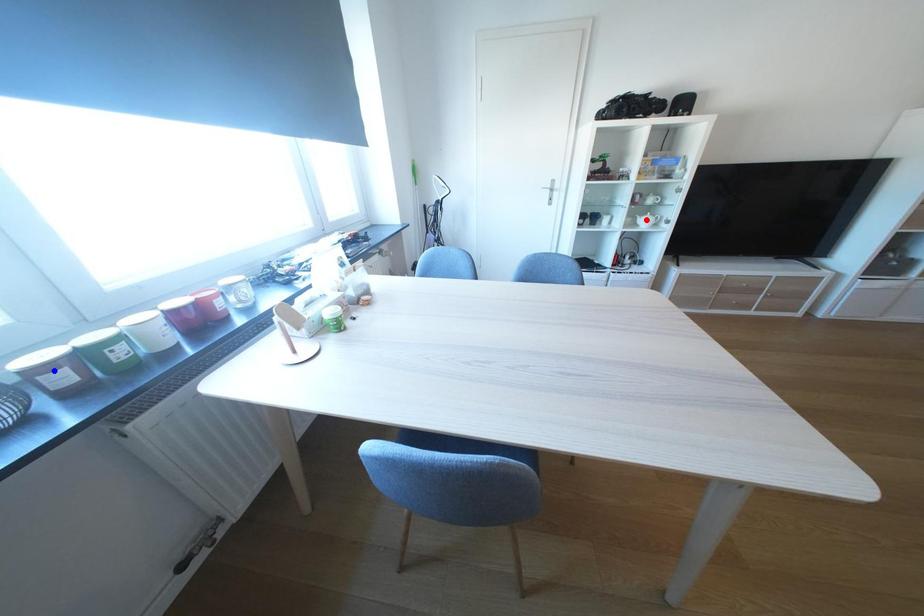
Question: Two points are marked on the image. Which point is closer to the camera?

Choices:
 (A) Blue point is closer.
 (B) Red point is closer.

Answer: (A)